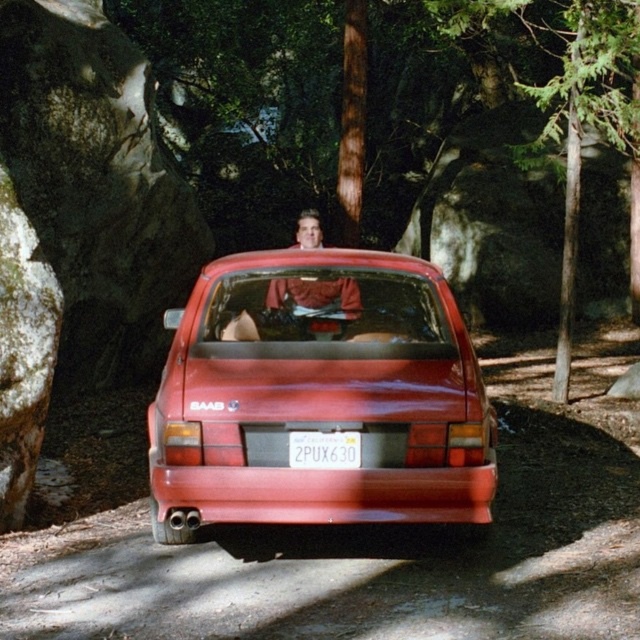
Question: Estimate the real-world distances between objects in this image. Which object is closer to the glossy red car at center?

Choices:
 (A) smooth leather jacket at center
 (B) white plastic license plate at center

Answer: (B)

Question: Does glossy red car at center appear on the left side of smooth leather jacket at center?

Choices:
 (A) no
 (B) yes

Answer: (A)

Question: Does glossy red car at center have a smaller size compared to smooth leather jacket at center?

Choices:
 (A) yes
 (B) no

Answer: (A)

Question: Which of the following is the closest to the observer?

Choices:
 (A) (301, 452)
 (B) (387, 458)

Answer: (A)

Question: Which of the following is the farthest from the observer?

Choices:
 (A) smooth leather jacket at center
 (B) white plastic license plate at center

Answer: (A)

Question: Can you confirm if smooth leather jacket at center is positioned to the right of white plastic license plate at center?

Choices:
 (A) yes
 (B) no

Answer: (B)